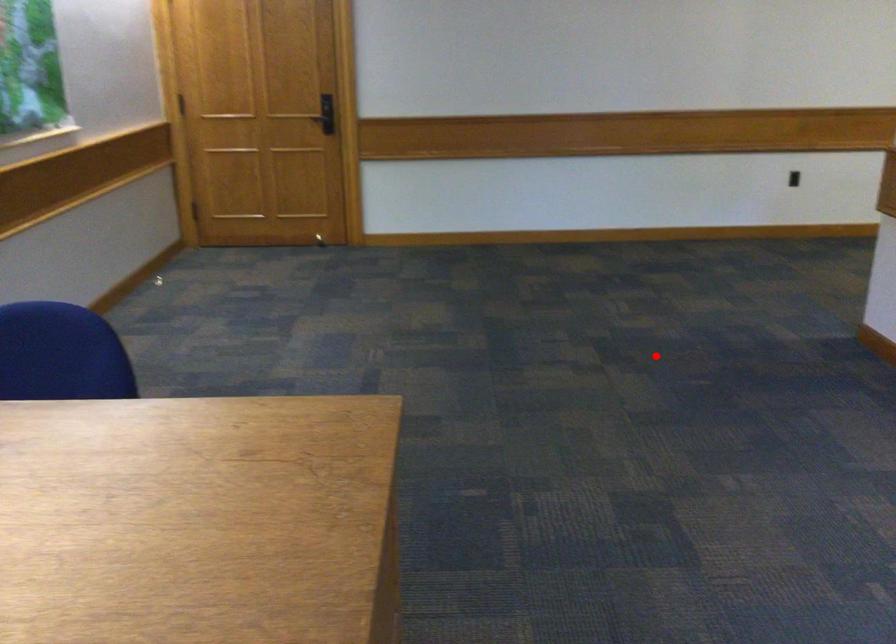
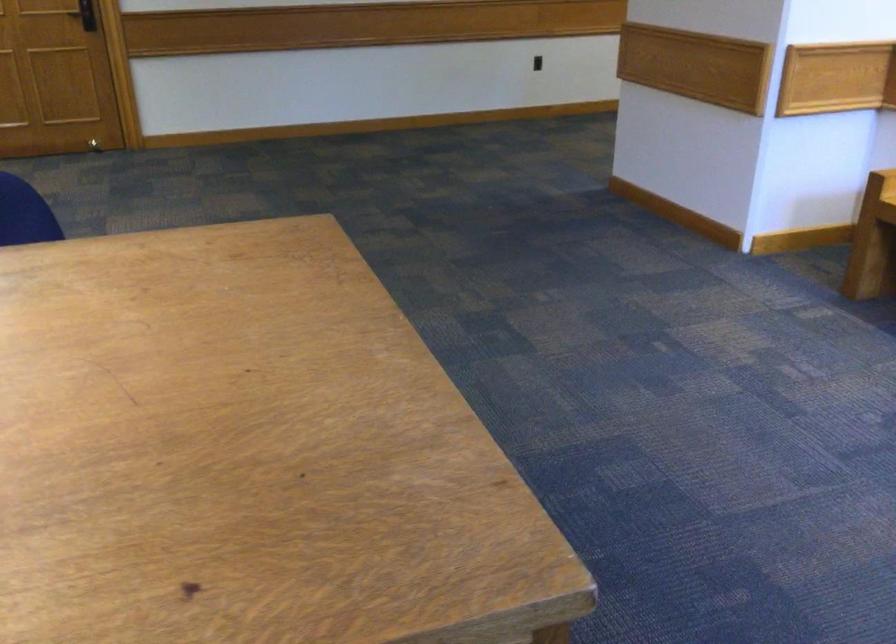
Find the pixel in the second image that matches the highlighted location in the first image.

(515, 214)